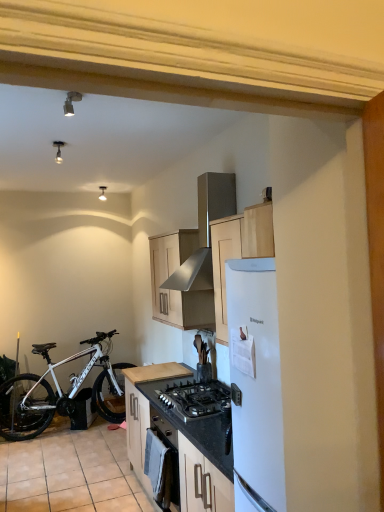
Question: Considering the positions of black matte oven at center and white matte bicycle at lower left in the image, is black matte oven at center bigger or smaller than white matte bicycle at lower left?

Choices:
 (A) small
 (B) big

Answer: (A)

Question: From the image's perspective, is black matte oven at center above or below white matte bicycle at lower left?

Choices:
 (A) above
 (B) below

Answer: (A)

Question: Estimate the real-world distances between objects in this image. Which object is farther from the black matte gas stove at center?

Choices:
 (A) matte silver light fixture at upper center
 (B) matte wood cabinet at center, positioned as the 1th cabinetry in top-to-bottom order
 (C) black matte oven at center
 (D) beige tile at lower left
 (E) white matte bicycle at lower left

Answer: (A)

Question: Estimate the real-world distances between objects in this image. Which object is closer to the black matte gas stove at center?

Choices:
 (A) beige tile at lower left
 (B) black matte oven at center
 (C) matte wood cabinet at center, positioned as the 1th cabinetry in top-to-bottom order
 (D) white matte bicycle at lower left
 (E) stainless steel range hood at upper center

Answer: (B)